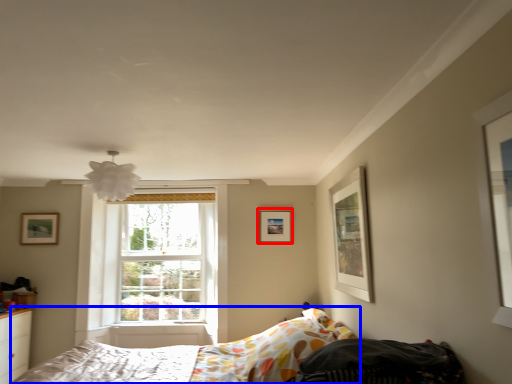
Question: Which of the following is the farthest to the observer, picture frame (highlighted by a red box) or bed (highlighted by a blue box)?

Choices:
 (A) picture frame
 (B) bed

Answer: (A)